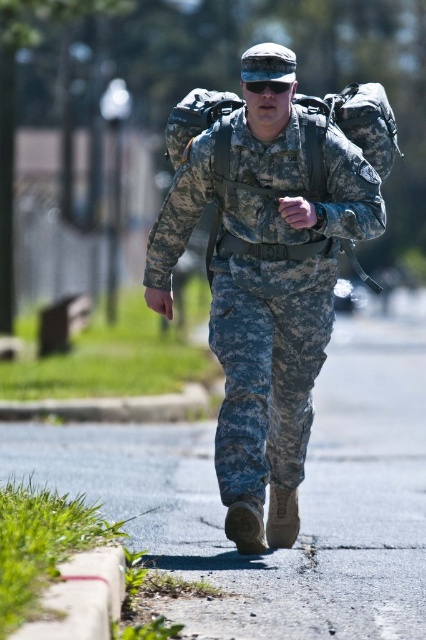
You are a drone operator controlling a drone that needs to fly from point A to point B. The points are marked as point (x=244, y=584) and point (x=285, y=84). The soldier is walking along the path between them. Which point should you avoid so the drone doesn t interfere with the soldier?

You should avoid flying near point (x=244, y=584) because it is in front of point (x=285, y=84), meaning the soldier is moving toward it and the drone might interfere with their path.

The soldier is walking on the asphalt pavement at center. If the soldier wants to step onto the camouflage fabric uniform at center, will they need to move sideways to reach it?

The asphalt pavement at center might be wider than camouflage fabric uniform at center, so the soldier might need to move sideways to align their position with the narrower camouflage fabric uniform at center.